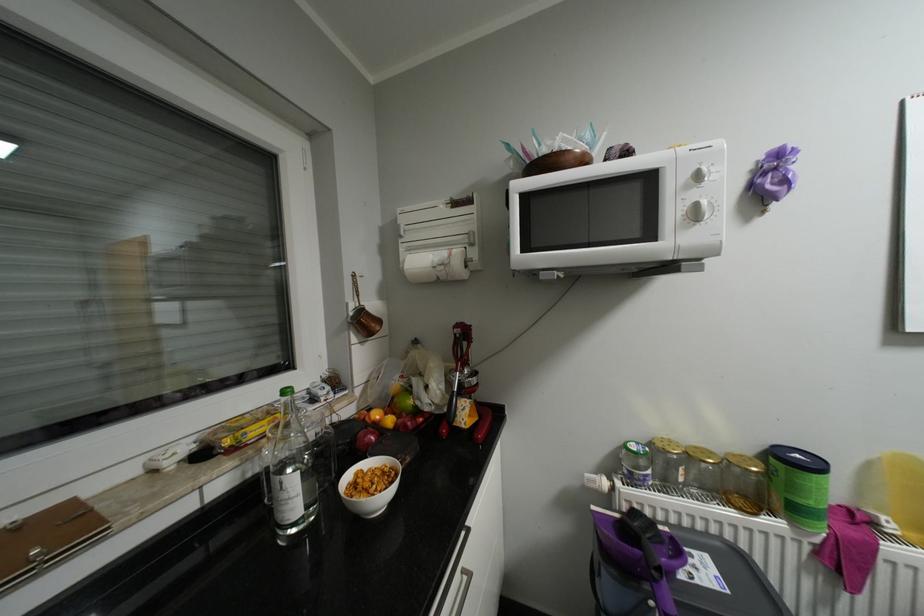
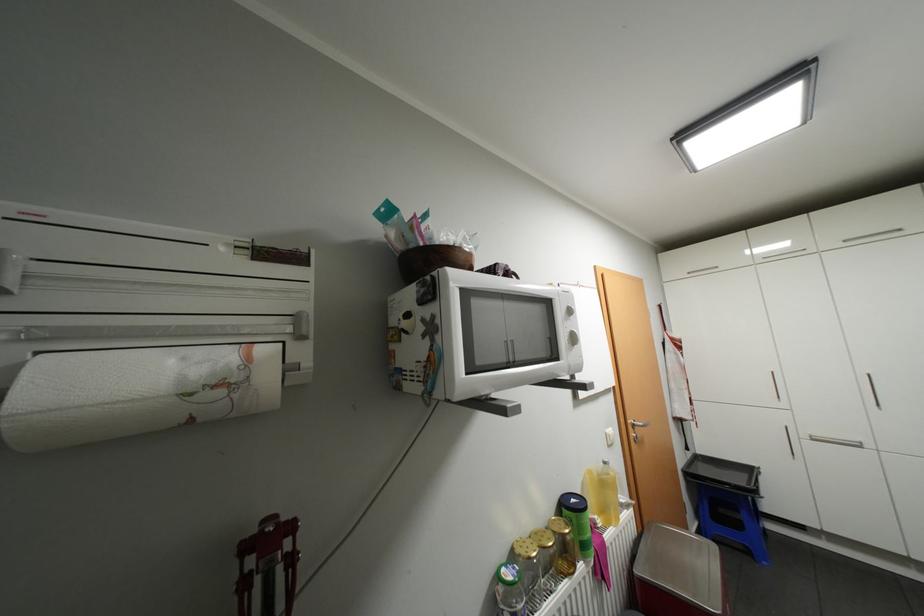
Locate, in the second image, the point that corresponds to [457,254] in the first image.

(256, 358)